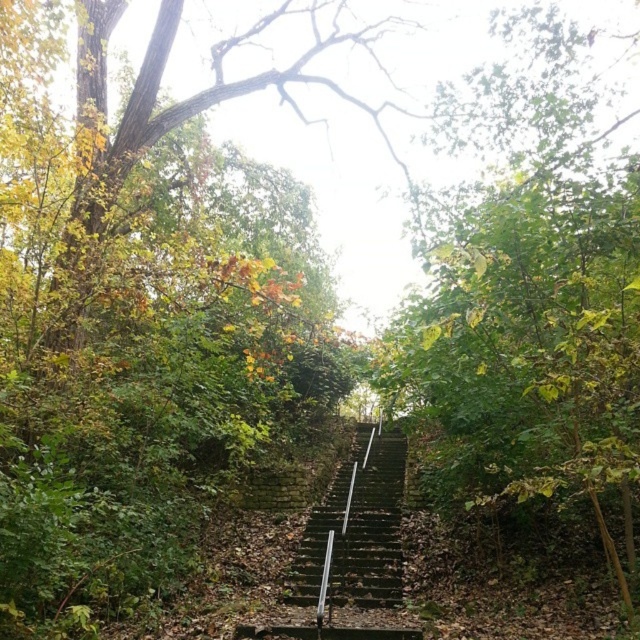
Question: Is green leafy tree at center below dark green stone stairs at center?

Choices:
 (A) no
 (B) yes

Answer: (A)

Question: Is the position of green leafy tree at center more distant than that of dark green stone stairs at center?

Choices:
 (A) yes
 (B) no

Answer: (A)

Question: Among these objects, which one is nearest to the camera?

Choices:
 (A) dark green stone stairs at center
 (B) green leafy tree at center

Answer: (A)

Question: Is green leafy tree at center in front of dark green stone stairs at center?

Choices:
 (A) no
 (B) yes

Answer: (A)